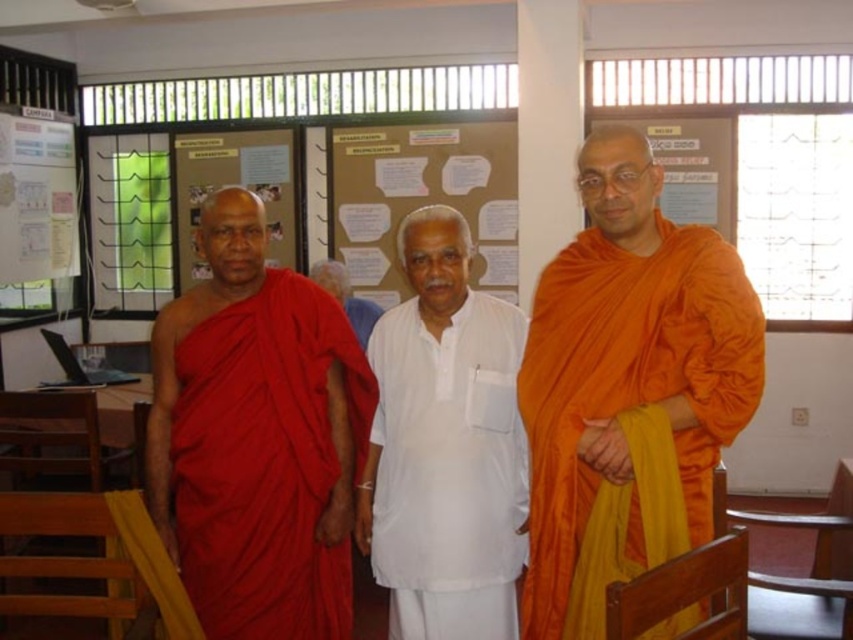
Is orange silk robe at center smaller than white cotton kurta at center?

Incorrect, orange silk robe at center is not smaller in size than white cotton kurta at center.

Which is above, orange silk robe at center or white cotton kurta at center?

Positioned higher is orange silk robe at center.

Who is more forward, (751,323) or (521,509)?

Point (751,323) is in front.

You are a GUI agent. You are given a task and a screenshot of the screen. Output one action in this format:
    pyautogui.click(x=<x>, y=<y>)
    Task: Click on the orange silk robe at center
    
    Given the screenshot: What is the action you would take?
    pyautogui.click(x=628, y=388)

Based on the photo, can you confirm if orange silk robe at center is positioned to the left of matte red robe at center?

No, orange silk robe at center is not to the left of matte red robe at center.

Does orange silk robe at center appear under matte red robe at center?

Actually, orange silk robe at center is above matte red robe at center.

Identify the location of orange silk robe at center. (628, 388).

Is point (405, 531) farther from camera compared to point (346, 294)?

No, (405, 531) is closer to viewer.

Can you confirm if white cotton kurta at center is positioned below white cotton shirt at center?

Correct, white cotton kurta at center is located below white cotton shirt at center.

Between point (369, 456) and point (361, 330), which one is positioned in front?

Point (369, 456)

I want to click on white cotton kurta at center, so click(x=450, y=468).